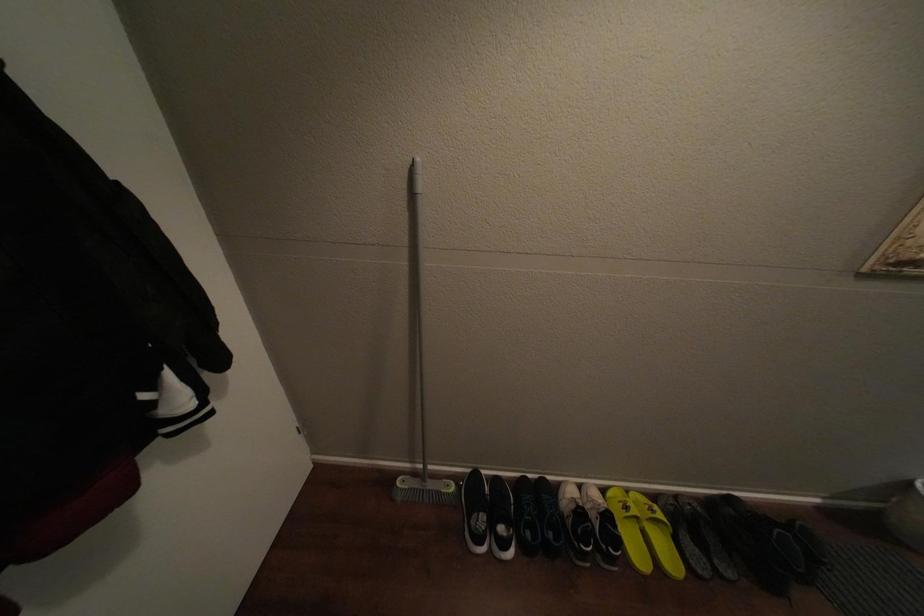
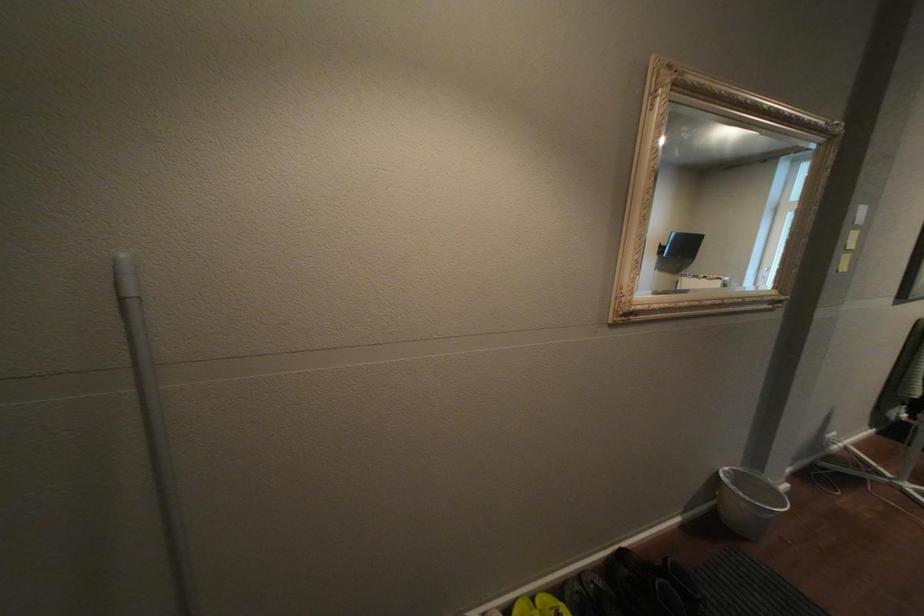
Question: The camera is either moving clockwise (left) or counter-clockwise (right) around the object. The first image is from the beginning of the video and the second image is from the end. Is the camera moving left or right when shooting the video?

Choices:
 (A) Left
 (B) Right

Answer: (A)